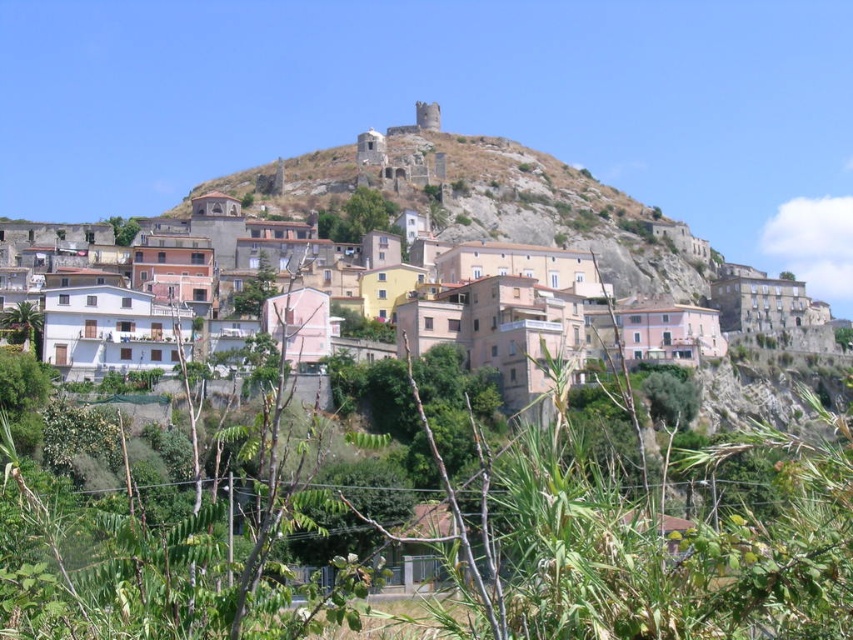
Question: Can you confirm if green leafy plants at center is wider than rustic stone castle at upper center?

Choices:
 (A) no
 (B) yes

Answer: (A)

Question: Among these objects, which one is farthest from the camera?

Choices:
 (A) pastel painted houses at center
 (B) rustic stone castle at upper center
 (C) green leafy plants at center

Answer: (B)

Question: Which of the following is the farthest from the observer?

Choices:
 (A) green leafy plants at center
 (B) pastel painted houses at center
 (C) rustic stone castle at upper center

Answer: (C)

Question: Is pastel painted houses at center below rustic stone castle at upper center?

Choices:
 (A) yes
 (B) no

Answer: (A)

Question: Among these points, which one is farthest from the camera?

Choices:
 (A) (62, 589)
 (B) (364, 172)
 (C) (541, 301)

Answer: (B)

Question: Is the position of pastel painted houses at center more distant than that of rustic stone castle at upper center?

Choices:
 (A) yes
 (B) no

Answer: (B)